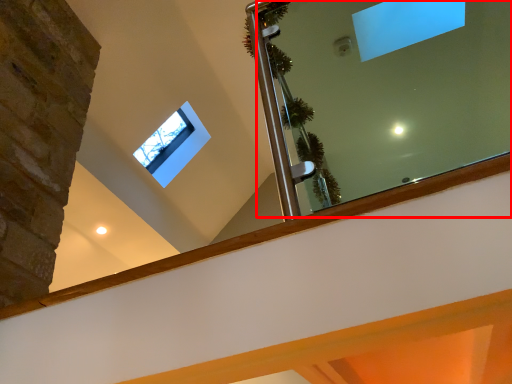
Question: In this image, where is mirror (annotated by the red box) located relative to window?

Choices:
 (A) right
 (B) left

Answer: (A)